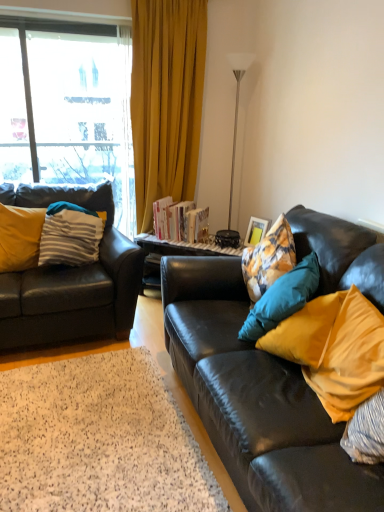
Question: Are white shag rug at lower left and matte yellow pillow at right, arranged as the 1th pillow when viewed from the front, making contact?

Choices:
 (A) yes
 (B) no

Answer: (B)

Question: Is white shag rug at lower left to the left of matte yellow pillow at right, which ranks as the fourth pillow in left-to-right order, from the viewer's perspective?

Choices:
 (A) yes
 (B) no

Answer: (A)

Question: Is white shag rug at lower left positioned beyond the bounds of matte yellow pillow at right, which ranks as the 4th pillow in back-to-front order?

Choices:
 (A) no
 (B) yes

Answer: (B)

Question: Is white shag rug at lower left thinner than matte yellow pillow at right, arranged as the 1th pillow when viewed from the front?

Choices:
 (A) no
 (B) yes

Answer: (A)

Question: Can you confirm if white shag rug at lower left is smaller than matte yellow pillow at right, which ranks as the 4th pillow in back-to-front order?

Choices:
 (A) yes
 (B) no

Answer: (A)

Question: Is yellow fabric pillow at left, which is the first pillow from left to right, in front of or behind matte yellow pillow at right, which ranks as the 4th pillow in back-to-front order, in the image?

Choices:
 (A) behind
 (B) front

Answer: (A)

Question: Is yellow fabric pillow at left, marked as the 3th pillow in a front-to-back arrangement, wider or thinner than matte yellow pillow at right, which ranks as the fourth pillow in left-to-right order?

Choices:
 (A) thin
 (B) wide

Answer: (A)

Question: Is yellow fabric pillow at left, marked as the fourth pillow in a right-to-left arrangement, taller or shorter than matte yellow pillow at right, which ranks as the fourth pillow in left-to-right order?

Choices:
 (A) tall
 (B) short

Answer: (B)

Question: Considering the positions of point (16, 256) and point (347, 295), is point (16, 256) closer or farther from the camera than point (347, 295)?

Choices:
 (A) farther
 (B) closer

Answer: (A)

Question: From the image's perspective, is silver metallic floor lamp at upper right located above or below striped fabric pillow at left, placed as the third pillow when sorted from right to left?

Choices:
 (A) below
 (B) above

Answer: (B)

Question: Is silver metallic floor lamp at upper right situated inside striped fabric pillow at left, which is the 4th pillow from front to back, or outside?

Choices:
 (A) inside
 (B) outside

Answer: (B)

Question: Looking at the image, does silver metallic floor lamp at upper right seem bigger or smaller compared to striped fabric pillow at left, which is the 4th pillow from front to back?

Choices:
 (A) small
 (B) big

Answer: (A)

Question: Considering their positions, is silver metallic floor lamp at upper right located in front of or behind striped fabric pillow at left, which is the first pillow in back-to-front order?

Choices:
 (A) front
 (B) behind

Answer: (B)

Question: Does point (350, 294) appear closer or farther from the camera than point (243, 243)?

Choices:
 (A) closer
 (B) farther

Answer: (A)

Question: Do you think matte yellow pillow at right, which ranks as the 4th pillow in back-to-front order, is within matte wooden picture frame at right, or outside of it?

Choices:
 (A) inside
 (B) outside

Answer: (B)